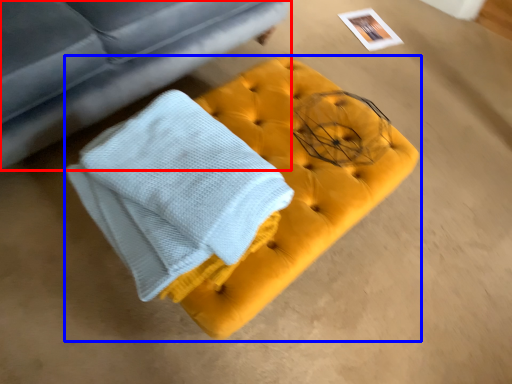
Question: Which point is further to the camera, studio couch (highlighted by a red box) or furniture (highlighted by a blue box)?

Choices:
 (A) studio couch
 (B) furniture

Answer: (B)